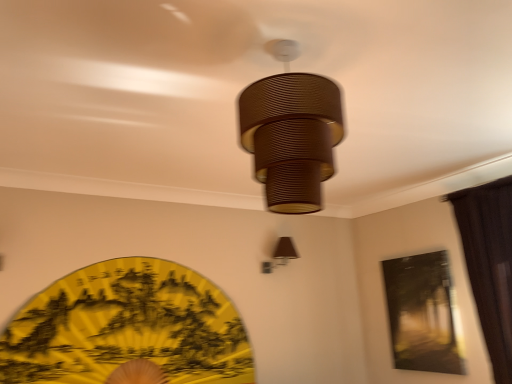
Question: Is brown ribbed lampshade at center, placed as the first lamp when sorted from top to bottom, spatially inside brown fabric lampshade at upper right, which appears as the first lamp when ordered from the bottom, or outside of it?

Choices:
 (A) outside
 (B) inside

Answer: (A)

Question: Considering the relative positions of brown ribbed lampshade at center, the 1th lamp when ordered from front to back, and brown fabric lampshade at upper right, which ranks as the second lamp in top-to-bottom order, in the image provided, is brown ribbed lampshade at center, the 1th lamp when ordered from front to back, to the left or to the right of brown fabric lampshade at upper right, which ranks as the second lamp in top-to-bottom order,?

Choices:
 (A) right
 (B) left

Answer: (B)

Question: Estimate the real-world distances between objects in this image. Which object is closer to the brown ribbed lampshade at center, acting as the second lamp starting from the bottom?

Choices:
 (A) brown fabric curtain at right
 (B) matte black painting at upper right
 (C) yellow paper fan at lower left
 (D) brown fabric lampshade at upper right, which appears as the first lamp when ordered from the bottom

Answer: (A)

Question: Which of these objects is positioned closest to the brown fabric lampshade at upper right, the 1th lamp positioned from the back?

Choices:
 (A) brown ribbed lampshade at center, acting as the second lamp starting from the bottom
 (B) yellow paper fan at lower left
 (C) matte black painting at upper right
 (D) brown fabric curtain at right

Answer: (C)